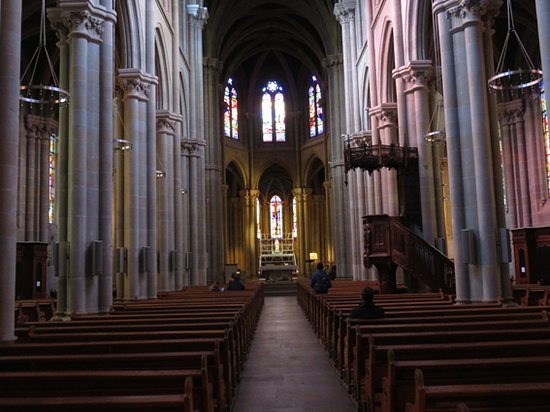
I want to click on hanging chandeliers, so click(x=40, y=100), click(x=120, y=140), click(x=159, y=169), click(x=186, y=192), click(x=209, y=200), click(x=431, y=138), click(x=519, y=75).